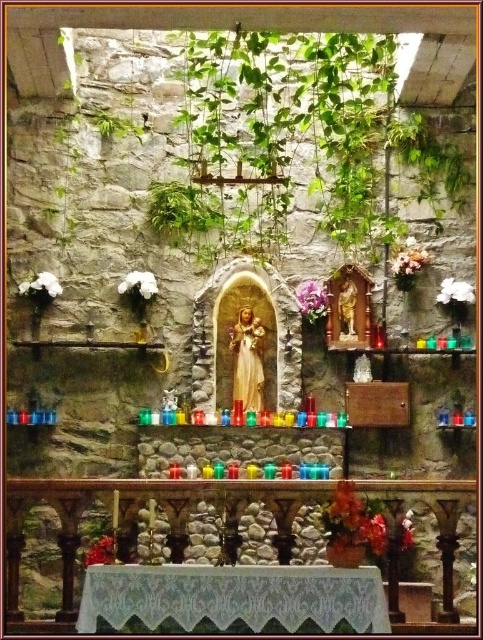
You are standing in front of the altar and want to place a candle on the matte red flower at lower right. Can you reach it without moving closer?

The matte red flower at lower right is 7.35 meters away from the viewer, so you cannot reach it without moving closer.

You are standing in front of the altar and want to place a small offering. The purple silk flower at center and the white matte flower at upper right are both on the altar. Which flower is positioned lower on the altar?

The purple silk flower at center is positioned lower on the altar than the white matte flower at upper right.

You are standing at point (44, 291) and want to reach the statue of the saint in the center. The altar is 37.32 feet long. Can you walk straight to the statue without any obstacles?

The distance between you and the statue is 37.32 feet, so yes, you can walk straight to the statue of the saint in the center as there are no mentioned obstacles in the scene description.